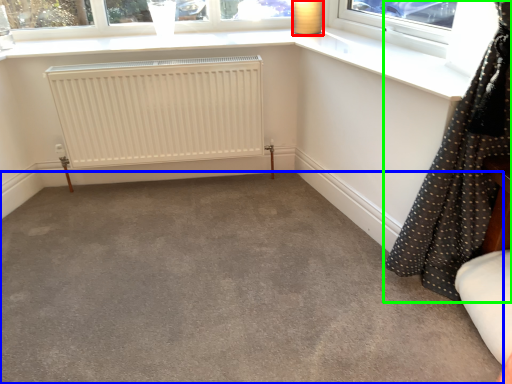
Question: Which object is the closest to the lamp (highlighted by a red box)? Choose among these: concrete (highlighted by a blue box) or curtain (highlighted by a green box).

Choices:
 (A) concrete
 (B) curtain

Answer: (B)